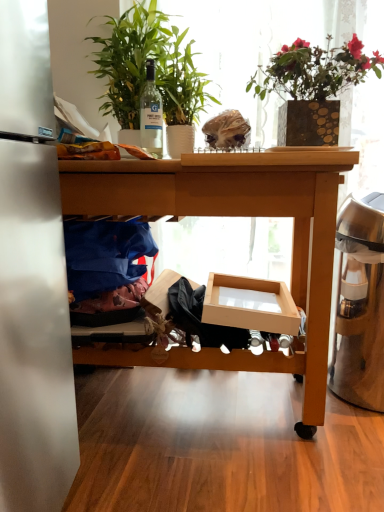
Question: From the image's perspective, is gold textured vase at upper right, marked as the second houseplant in a left-to-right arrangement, positioned above or below wooden desk at center?

Choices:
 (A) above
 (B) below

Answer: (A)

Question: Considering the positions of gold textured vase at upper right, placed as the first houseplant when sorted from right to left, and wooden desk at center in the image, is gold textured vase at upper right, placed as the first houseplant when sorted from right to left, wider or thinner than wooden desk at center?

Choices:
 (A) wide
 (B) thin

Answer: (B)

Question: Considering the real-world distances, which object is farthest from the gold textured vase at upper right, marked as the second houseplant in a left-to-right arrangement?

Choices:
 (A) wooden desk at center
 (B) cardboard box at center
 (C) green leafy plant at upper left, marked as the first houseplant in a left-to-right arrangement
 (D) clear glass bottle at center
 (E) satin silver trash can at right

Answer: (B)

Question: Based on their relative distances, which object is nearer to the gold textured vase at upper right, marked as the second houseplant in a left-to-right arrangement?

Choices:
 (A) cardboard box at center
 (B) green leafy plant at upper left, which is counted as the 2th houseplant, starting from the right
 (C) wooden desk at center
 (D) clear glass bottle at center
 (E) satin silver trash can at right

Answer: (C)